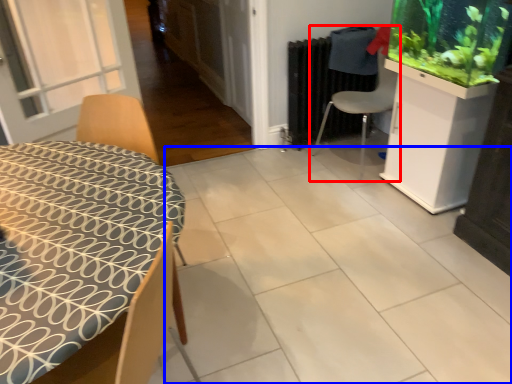
Question: Which of the following is the closest to the observer, chair (highlighted by a red box) or tile (highlighted by a blue box)?

Choices:
 (A) chair
 (B) tile

Answer: (B)